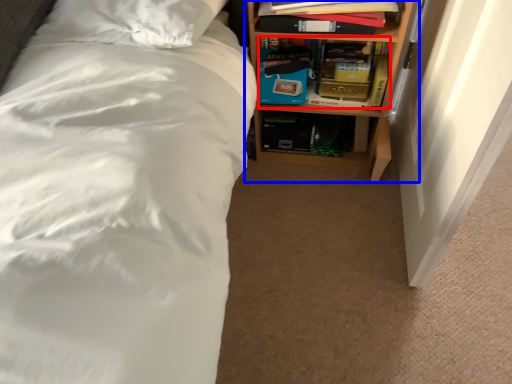
Question: Which object is closer to the camera taking this photo, book (highlighted by a red box) or shelf (highlighted by a blue box)?

Choices:
 (A) book
 (B) shelf

Answer: (B)